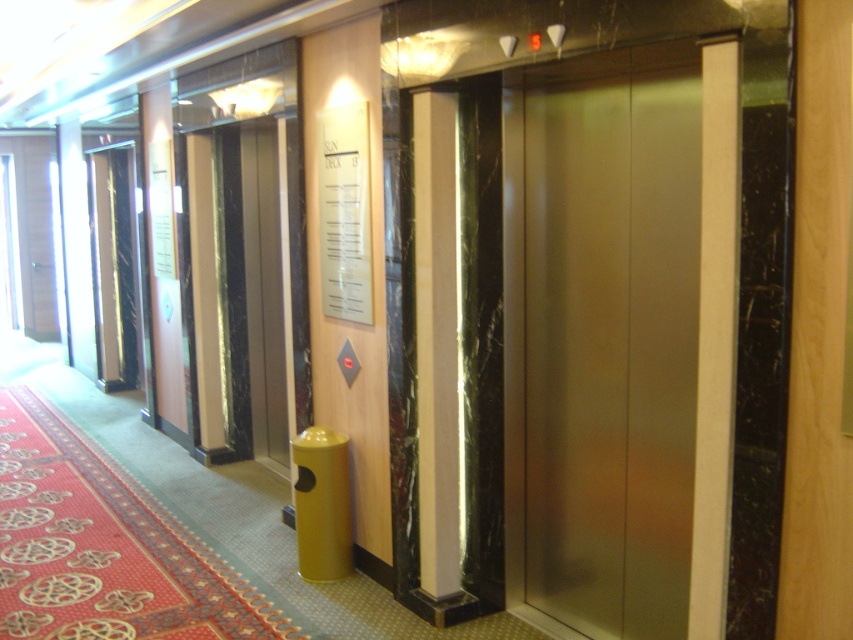
You are standing in the hallway and need to reach the Sun Deck 13 signboard. Which direction should you move relative to the satin gold elevator at center?

The satin gold elevator at center is located at point (x=602, y=337). Since the signboard is mounted on the wall near the elevators, you should move towards the right side of the hallway where the elevator doors are located to reach the Sun Deck 13 signboard.